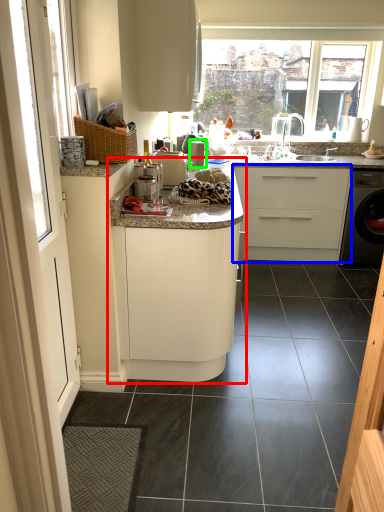
Question: Which is nearer to the cabinetry (highlighted by a red box)? cabinetry (highlighted by a blue box) or appliance (highlighted by a green box).

Choices:
 (A) cabinetry
 (B) appliance

Answer: (B)